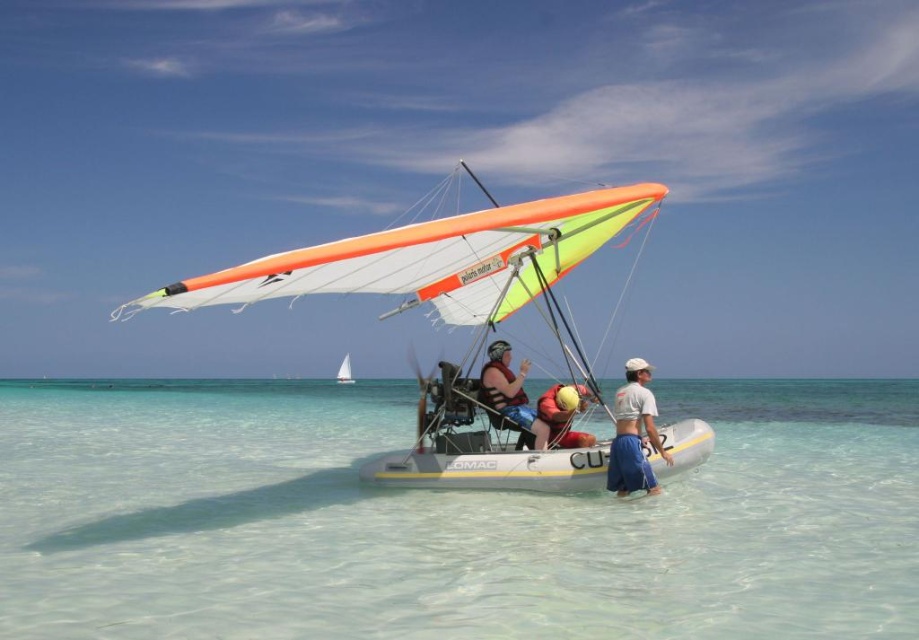
Measure the distance between point (560,452) and camera.

Point (560,452) is 11.23 meters away from camera.

Does yellow rubber boat at center come in front of white cotton shirt at center?

Yes, it is.

Image resolution: width=919 pixels, height=640 pixels. What do you see at coordinates (440, 264) in the screenshot?
I see `yellow rubber boat at center` at bounding box center [440, 264].

This screenshot has height=640, width=919. In order to click on yellow rubber boat at center in this screenshot , I will do `click(440, 264)`.

Between yellow fabric helmet at center and white sail at center, which one has more height?

white sail at center is taller.

Between yellow fabric helmet at center and white sail at center, which one is positioned lower?

white sail at center is lower down.

The height and width of the screenshot is (640, 919). What are the coordinates of `yellow fabric helmet at center` in the screenshot? It's located at (564, 413).

Is point (503, 349) farther from camera compared to point (350, 376)?

No.

This screenshot has width=919, height=640. What are the coordinates of `orange life vest at center` in the screenshot? It's located at (509, 396).